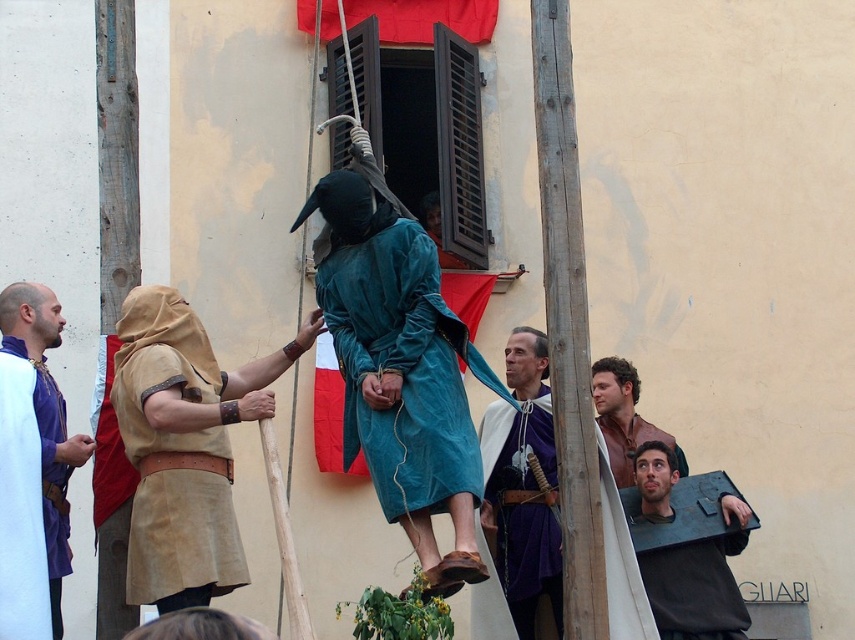
Question: Which is nearer to the wooden pole at center?

Choices:
 (A) tan leather tunic at left
 (B) dark gray leather shield at lower right
 (C) matte purple tunic at left

Answer: (B)

Question: Which point appears farthest from the camera in this image?

Choices:
 (A) (146, 474)
 (B) (529, 468)
 (C) (593, 401)
 (D) (573, 504)

Answer: (B)

Question: Is matte purple tunic at left to the right of brown leather jacket at upper right from the viewer's perspective?

Choices:
 (A) no
 (B) yes

Answer: (A)

Question: Which point is closer to the camera taking this photo?

Choices:
 (A) (42, 500)
 (B) (699, 602)

Answer: (A)

Question: Is tan leather tunic at left positioned before matte blue robe at center?

Choices:
 (A) yes
 (B) no

Answer: (A)

Question: Can you confirm if wooden pole at center is positioned to the right of dark gray leather shield at lower right?

Choices:
 (A) yes
 (B) no

Answer: (B)